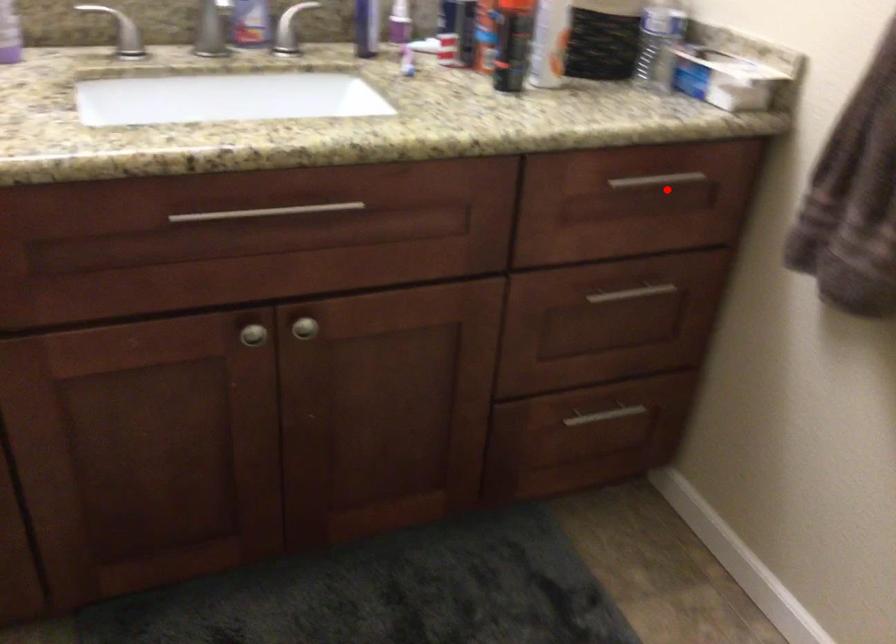
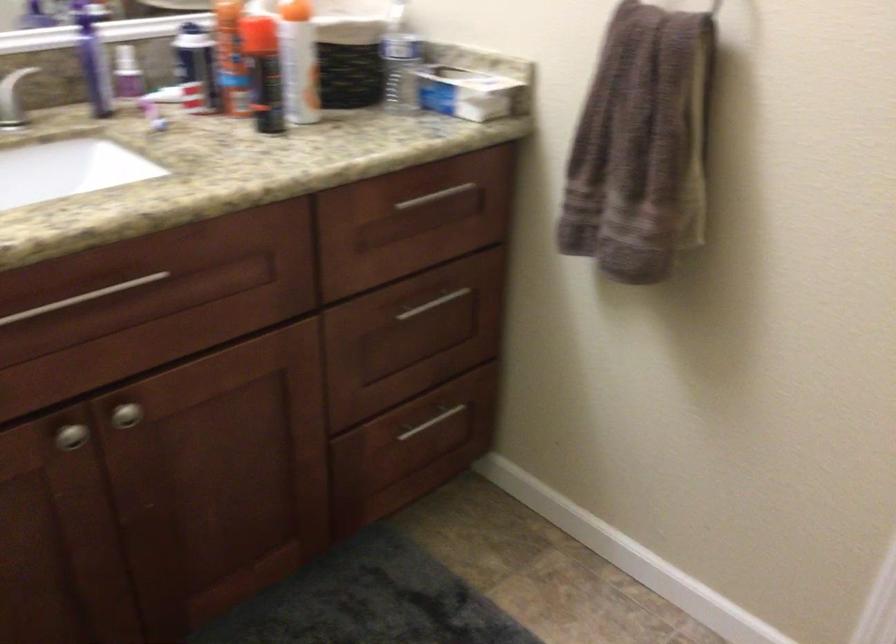
Locate, in the second image, the point that corresponds to the highlighted location in the first image.

(445, 201)